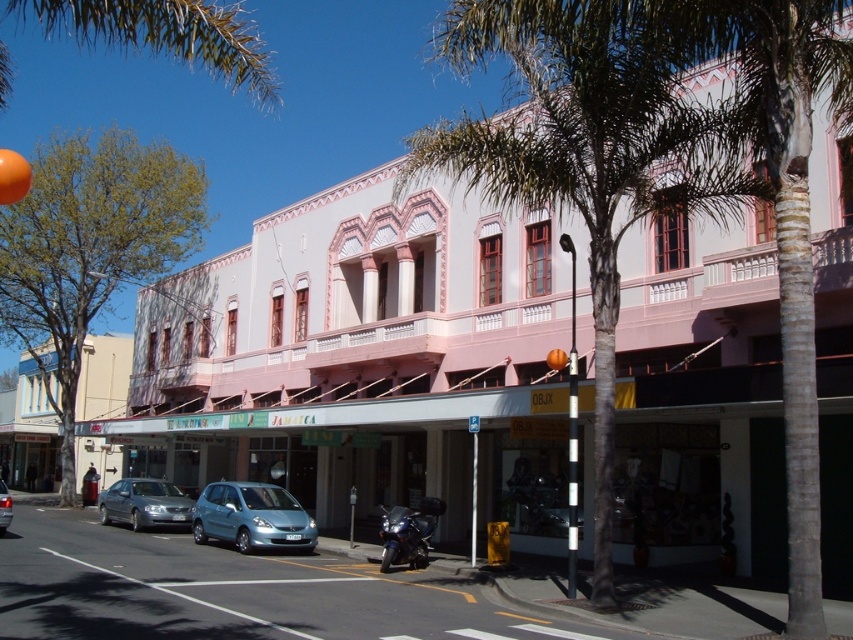
Between metallic blue hatchback at center and silver metallic sedan at lower left, which one is positioned higher?

metallic blue hatchback at center

Does metallic blue hatchback at center have a greater width compared to silver metallic sedan at lower left?

Incorrect, metallic blue hatchback at center's width does not surpass silver metallic sedan at lower left's.

Identify the location of metallic blue hatchback at center. This screenshot has height=640, width=853. (251, 516).

This screenshot has width=853, height=640. Find the location of `green leafy palm tree at upper left`. green leafy palm tree at upper left is located at coordinates (166, 35).

Who is taller, green leafy palm tree at upper left or silver metallic sedan at lower left?

With more height is green leafy palm tree at upper left.

Does point (100, 10) lie behind point (144, 515)?

No, it is in front of (144, 515).

Identify the location of green leafy palm tree at upper left. (166, 35).

Which of these two, green leafy palm tree at center or metallic blue hatchback at center, stands taller?

With more height is green leafy palm tree at center.

Is point (614, 172) more distant than point (229, 516)?

No, it is in front of (229, 516).

The image size is (853, 640). In order to click on green leafy palm tree at center in this screenshot , I will do `click(585, 154)`.